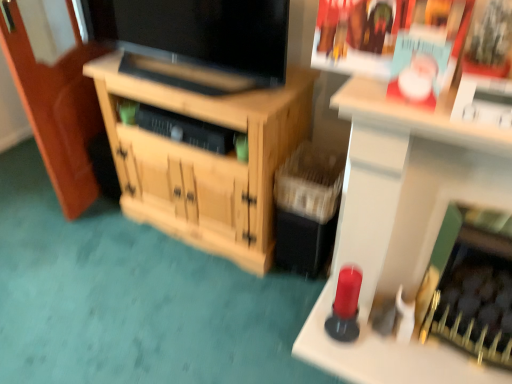
Question: In terms of size, does matte black tv at center appear bigger or smaller than wooden cabinet at center?

Choices:
 (A) small
 (B) big

Answer: (A)

Question: Does point (153, 74) appear closer or farther from the camera than point (293, 100)?

Choices:
 (A) closer
 (B) farther

Answer: (B)

Question: Estimate the real-world distances between objects in this image. Which object is farther from the matte black tv at center?

Choices:
 (A) matte paper magazine at upper right
 (B) wooden cabinet at center

Answer: (A)

Question: Based on their relative distances, which object is farther from the matte paper magazine at upper right?

Choices:
 (A) wooden cabinet at center
 (B) matte black tv at center

Answer: (A)